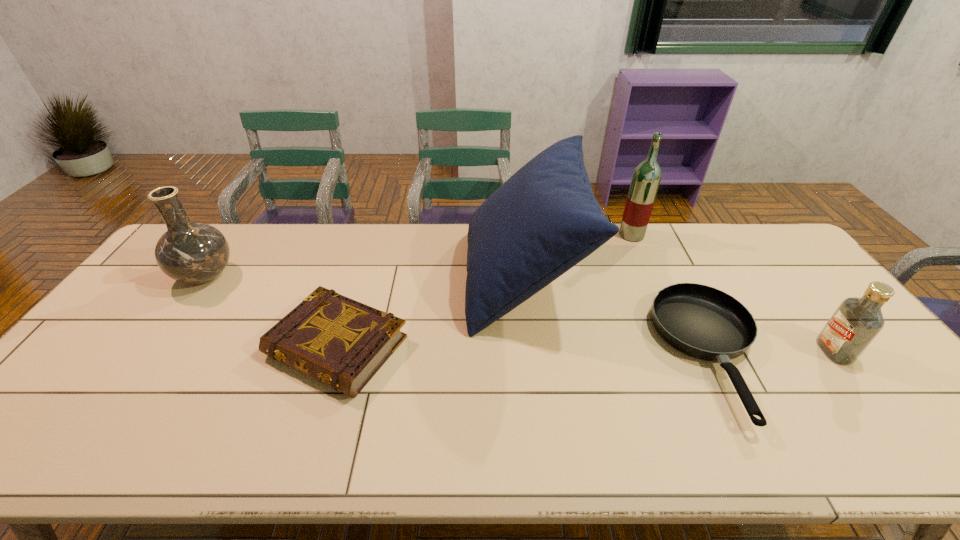
Where is `blank region between the leftmost object and the fifth tallest object`? The image size is (960, 540). blank region between the leftmost object and the fifth tallest object is located at coordinates (272, 312).

Image resolution: width=960 pixels, height=540 pixels. What are the coordinates of `free spot between the third shortest object and the shortest object` in the screenshot? It's located at (773, 353).

Where is `vacant space in between the second shortest object and the leftmost object`? Image resolution: width=960 pixels, height=540 pixels. vacant space in between the second shortest object and the leftmost object is located at coordinates (272, 312).

Locate an element on the screen. This screenshot has width=960, height=540. free space between the frying pan and the fifth tallest object is located at coordinates (524, 352).

Identify the location of empty space between the vase and the third object from left to right. The height and width of the screenshot is (540, 960). (365, 277).

This screenshot has width=960, height=540. I want to click on free space between the second shortest object and the vodka, so click(586, 349).

Locate which object is the fourth closest to the third shortest object. Please provide its 2D coordinates. Your answer should be formatted as a tuple, i.e. [(x, y)], where the tuple contains the x and y coordinates of a point satisfying the conditions above.

[(342, 343)]

Locate an element on the screen. This screenshot has height=540, width=960. object that is the third closest to the fifth object from right to left is located at coordinates (703, 322).